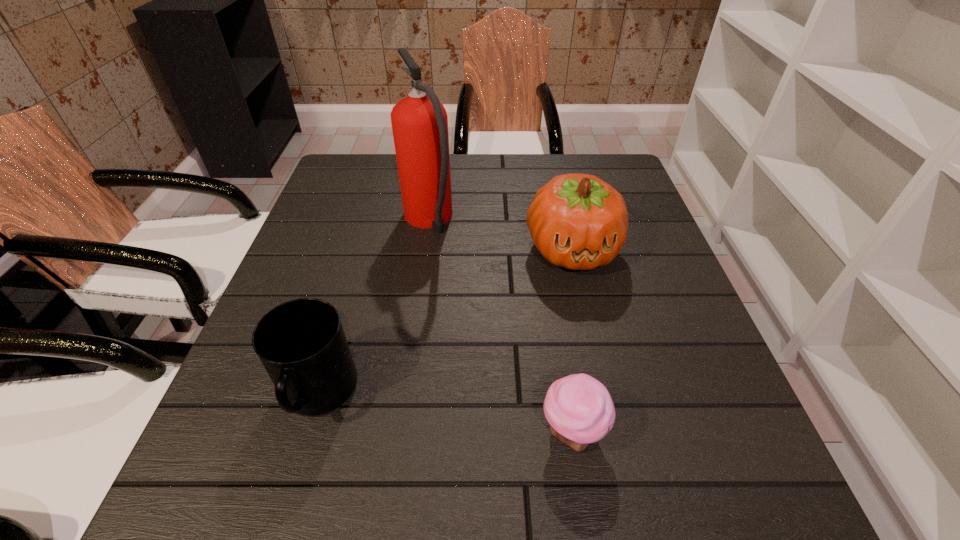
At what (x,y) coordinates should I click in order to perform the action: click on vacant space located on the back of the cupcake. Please return your answer as a coordinate pair (x, y). The image size is (960, 540). Looking at the image, I should click on (560, 354).

At what (x,y) coordinates should I click in order to perform the action: click on object that is at the far edge. Please return your answer as a coordinate pair (x, y). The image size is (960, 540). Looking at the image, I should click on (419, 122).

This screenshot has width=960, height=540. I want to click on object that is at the near edge, so click(579, 408).

The height and width of the screenshot is (540, 960). In order to click on object at the left edge in this screenshot , I will do `click(301, 343)`.

Locate an element on the screen. The image size is (960, 540). object that is at the right edge is located at coordinates (577, 221).

This screenshot has height=540, width=960. In the image, there is a desktop. What are the coordinates of `vacant space at the far edge` in the screenshot? It's located at (454, 160).

What are the coordinates of `vacant space at the left edge` in the screenshot? It's located at (324, 214).

Where is `vacant space at the right edge of the desktop`? The image size is (960, 540). vacant space at the right edge of the desktop is located at coordinates (688, 417).

What are the coordinates of `free region at the near left corner of the desktop` in the screenshot? It's located at (205, 517).

At what (x,y) coordinates should I click in order to perform the action: click on blank area at the far right corner. Please return your answer as a coordinate pair (x, y). Looking at the image, I should click on pos(612,156).